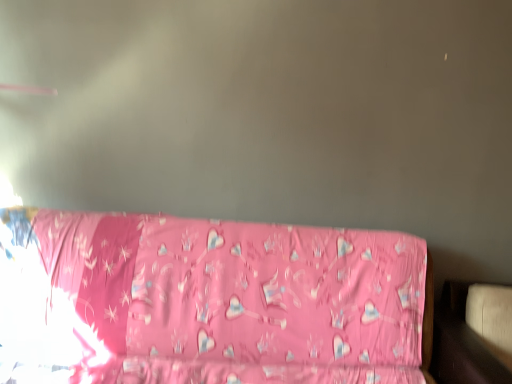
Image resolution: width=512 pixels, height=384 pixels. What do you see at coordinates (209, 301) in the screenshot?
I see `pink fabric bed at center` at bounding box center [209, 301].

Where is `pink fabric bed at center`? The image size is (512, 384). pink fabric bed at center is located at coordinates (209, 301).

Measure the distance between point (376, 320) and camera.

Point (376, 320) is 1.83 meters from camera.

Find the location of a particular element. This screenshot has height=384, width=512. pink fabric bed at center is located at coordinates (209, 301).